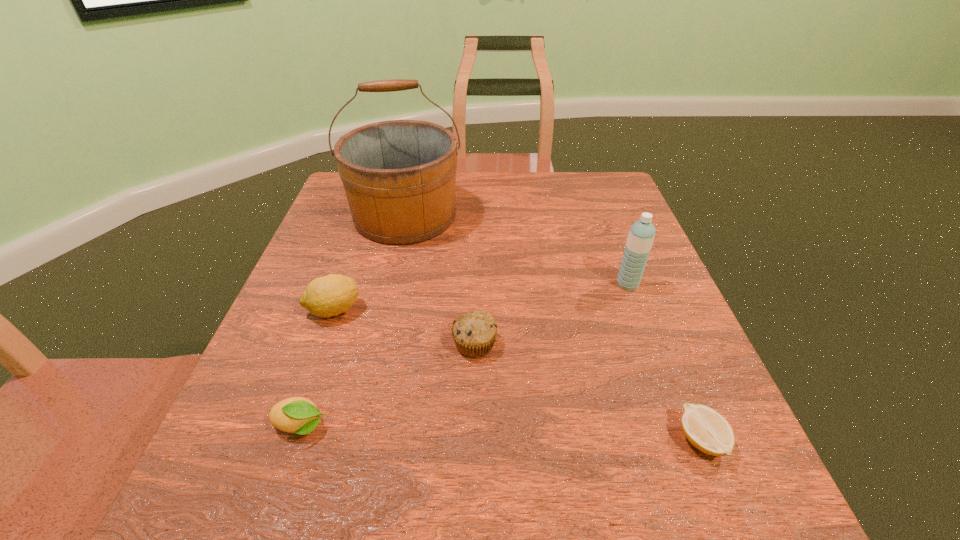
Locate an element on the screen. vacant space located on the right of the tallest object is located at coordinates (560, 215).

You are a GUI agent. You are given a task and a screenshot of the screen. Output one action in this format:
    pyautogui.click(x=<x>, y=<y>)
    Task: Click on the blank space located on the back of the second tallest object
    The height and width of the screenshot is (540, 960).
    Given the screenshot: What is the action you would take?
    click(608, 232)

Find the location of a particular element. The height and width of the screenshot is (540, 960). free location located at the stem end of the third farthest object is located at coordinates tap(437, 310).

Where is `vacant region located 0.050m on the left of the fourth farthest object`? The height and width of the screenshot is (540, 960). vacant region located 0.050m on the left of the fourth farthest object is located at coordinates (425, 344).

Image resolution: width=960 pixels, height=540 pixels. Find the location of `vacant space located with leaves positioned above the second shortest lemon`. vacant space located with leaves positioned above the second shortest lemon is located at coordinates (374, 427).

Find the location of a particular element. The height and width of the screenshot is (540, 960). vacant space located 0.350m on the left of the shortest object is located at coordinates (446, 441).

Locate an element on the screen. Image resolution: width=960 pixels, height=540 pixels. object at the far edge is located at coordinates (399, 176).

Where is `bucket that is at the left edge`? The height and width of the screenshot is (540, 960). bucket that is at the left edge is located at coordinates (399, 176).

The width and height of the screenshot is (960, 540). In order to click on water bottle located in the right edge section of the desktop in this screenshot , I will do `click(641, 235)`.

Where is `lemon that is at the right edge`? lemon that is at the right edge is located at coordinates (x=707, y=430).